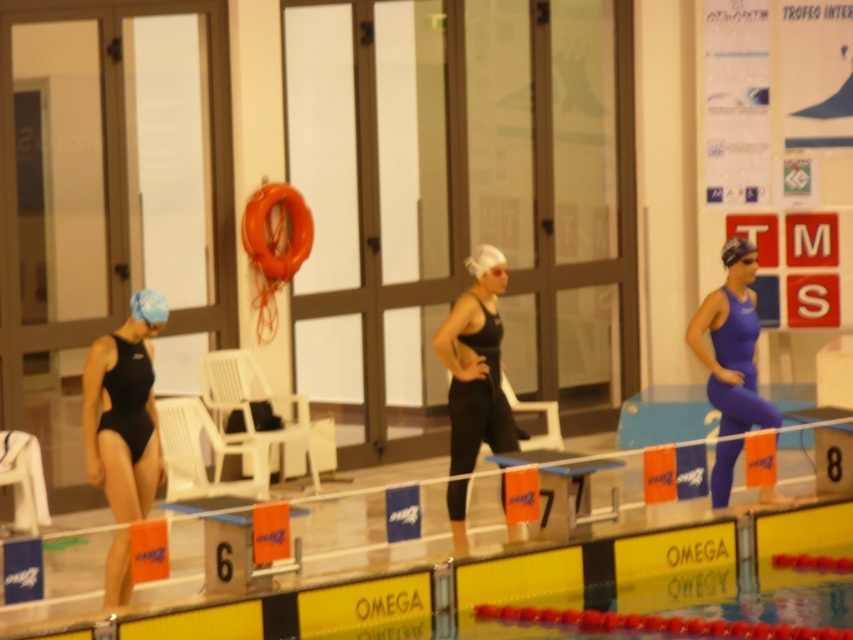
You are a lifeguard observing the pool area. There is a black matte swimsuit at center and a blue matte swim cap at center. Which object is bigger in size?

The black matte swimsuit at center is larger in size than the blue matte swim cap at center.

You are a lifeguard observing the pool area. There is a black matte swimsuit at center and a blue matte swim cap at upper left. Which object is wider?

The black matte swimsuit at center is wider than the blue matte swim cap at upper left.

You are a lifeguard observing the pool area. There is a black matte swimsuit at center and a blue matte swim cap at center. Which object is closer to you?

The black matte swimsuit at center is closer to you because it is in front of the blue matte swim cap at center.